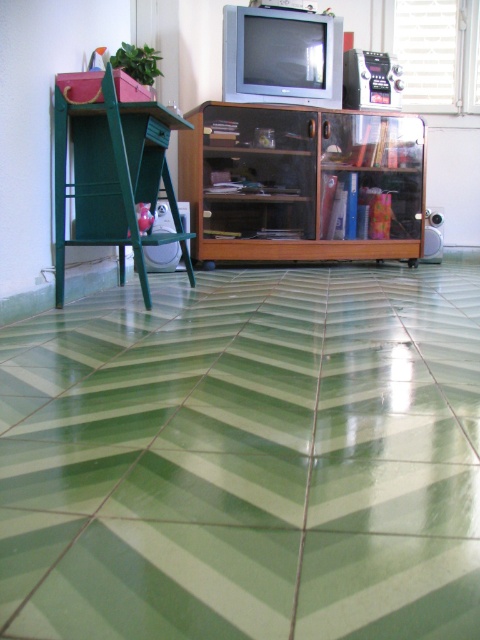
You are a cleaning robot with a width of 1 meter. You are positioned in the room and want to move from the green glossy tile at center to the wooden cabinet at center. Can you pass through the space between them without any obstacles?

The distance between the green glossy tile at center and wooden cabinet at center is 1.33 meters. Since your width is 1 meter, you can pass through the space as the distance is greater than your width.

You are standing in the room with the green and white striped floor. There is a point at coordinates (48, 579). If you want to place a 20 inch wide decorative item exactly at that point, will there be enough space?

The distance between the point and the viewer is 22.95 inches. Since the decorative item is only 20 inches wide, there is enough space to place it at that point.

You are arranging furniture in the room with the green and white striped floor. You have a wooden cabinet at center and a green matte stool at left. According to the current layout, which object is located to the right of the other?

The wooden cabinet at center is positioned on the right side of green matte stool at left, so the wooden cabinet at center is to the right of the green matte stool at left.